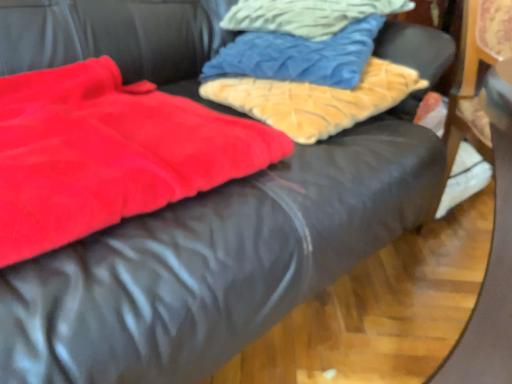
Locate an element on the screen. This screenshot has height=384, width=512. fuzzy beige pillow at upper center, the third cloth from the top is located at coordinates (316, 99).

Measure the distance between point (351, 75) and camera.

The depth of point (351, 75) is 32.87 inches.

Measure the distance between point (47, 148) and camera.

They are 22.72 inches apart.

At what (x,y) coordinates should I click in order to perform the action: click on fuzzy beige pillow at upper center, the third cloth from the top. Please return your answer as a coordinate pair (x, y). Looking at the image, I should click on (316, 99).

Is velvet blue pillow at upper center, positioned as the first cloth in top-to-bottom order, inside or outside of velvety red blanket at left?

velvet blue pillow at upper center, positioned as the first cloth in top-to-bottom order, cannot be found inside velvety red blanket at left.

Is velvet blue pillow at upper center, which is the third cloth in bottom-to-top order, in front of or behind velvety red blanket at left in the image?

Clearly, velvet blue pillow at upper center, which is the third cloth in bottom-to-top order, is behind velvety red blanket at left.

Can you confirm if velvet blue pillow at upper center, positioned as the first cloth in top-to-bottom order, is positioned to the right of velvety red blanket at left?

Yes.

Does velvet blue pillow at upper center, positioned as the first cloth in top-to-bottom order, touch velvety red blanket at left?

velvet blue pillow at upper center, positioned as the first cloth in top-to-bottom order, and velvety red blanket at left are clearly separated.

Is point (321, 41) farther from camera compared to point (318, 21)?

No.

In the image, is velvet blue pillow at upper center, the 2th cloth positioned from the bottom, positioned in front of or behind velvet blue pillow at upper center, positioned as the first cloth in top-to-bottom order?

Visually, velvet blue pillow at upper center, the 2th cloth positioned from the bottom, is located in front of velvet blue pillow at upper center, positioned as the first cloth in top-to-bottom order.

From the image's perspective, would you say velvet blue pillow at upper center, the 2th cloth positioned from the bottom, is shown under velvet blue pillow at upper center, which is the third cloth in bottom-to-top order?

Indeed, from the image's perspective, velvet blue pillow at upper center, the 2th cloth positioned from the bottom, is shown beneath velvet blue pillow at upper center, which is the third cloth in bottom-to-top order.

Can velvet blue pillow at upper center, which is the third cloth in bottom-to-top order, be found inside velvet blue pillow at upper center, the 2th cloth positioned from the bottom?

Yes.

Does velvet blue pillow at upper center, which is the third cloth in bottom-to-top order, come in front of fuzzy beige pillow at upper center, the third cloth from the top?

No, it is not.

Is velvet blue pillow at upper center, which is the third cloth in bottom-to-top order, far away from fuzzy beige pillow at upper center, the 1th cloth from the bottom?

They are positioned close to each other.

You are a GUI agent. You are given a task and a screenshot of the screen. Output one action in this format:
    pyautogui.click(x=<x>, y=<y>)
    Task: Click on the 2nd cloth behind when counting from the fuzzy beige pillow at upper center, the third cloth from the top
    
    Given the screenshot: What is the action you would take?
    pyautogui.click(x=306, y=15)

Image resolution: width=512 pixels, height=384 pixels. Find the location of `cloth that is the 1st object located behind the velvety red blanket at left`. cloth that is the 1st object located behind the velvety red blanket at left is located at coordinates point(316,99).

Considering the relative sizes of velvety red blanket at left and fuzzy beige pillow at upper center, the third cloth from the top, in the image provided, is velvety red blanket at left bigger than fuzzy beige pillow at upper center, the third cloth from the top,?

Correct, velvety red blanket at left is larger in size than fuzzy beige pillow at upper center, the third cloth from the top.

Looking at their sizes, would you say velvety red blanket at left is wider or thinner than fuzzy beige pillow at upper center, the third cloth from the top?

velvety red blanket at left is wider than fuzzy beige pillow at upper center, the third cloth from the top.

Does velvety red blanket at left have a smaller size compared to velvet blue pillow at upper center, the 2th cloth positioned from the bottom?

Correct, velvety red blanket at left occupies less space than velvet blue pillow at upper center, the 2th cloth positioned from the bottom.

Is velvety red blanket at left beside velvet blue pillow at upper center, the 2th cloth positioned from the bottom?

velvety red blanket at left and velvet blue pillow at upper center, the 2th cloth positioned from the bottom, are clearly separated.

Could you tell me if velvety red blanket at left is turned towards velvet blue pillow at upper center, the 2th cloth from the top?

No, velvety red blanket at left is not facing towards velvet blue pillow at upper center, the 2th cloth from the top.

In the image, is fuzzy beige pillow at upper center, the 1th cloth from the bottom, positioned in front of or behind velvety red blanket at left?

Clearly, fuzzy beige pillow at upper center, the 1th cloth from the bottom, is behind velvety red blanket at left.

Would you say fuzzy beige pillow at upper center, the third cloth from the top, is inside or outside velvety red blanket at left?

fuzzy beige pillow at upper center, the third cloth from the top, exists outside the volume of velvety red blanket at left.

In terms of height, does fuzzy beige pillow at upper center, the third cloth from the top, look taller or shorter compared to velvety red blanket at left?

In the image, fuzzy beige pillow at upper center, the third cloth from the top, appears to be taller than velvety red blanket at left.

Consider the image. Can you tell me how much fuzzy beige pillow at upper center, the 1th cloth from the bottom, and velvety red blanket at left differ in facing direction?

2.83 degrees.

Is fuzzy beige pillow at upper center, the third cloth from the top, wider or thinner than velvet blue pillow at upper center, the 2th cloth from the top?

fuzzy beige pillow at upper center, the third cloth from the top, is wider than velvet blue pillow at upper center, the 2th cloth from the top.

Which is less distant, [339,93] or [288,69]?

The point [339,93] is in front.

In the image, is fuzzy beige pillow at upper center, the 1th cloth from the bottom, positioned in front of or behind velvet blue pillow at upper center, the 2th cloth from the top?

Visually, fuzzy beige pillow at upper center, the 1th cloth from the bottom, is located in front of velvet blue pillow at upper center, the 2th cloth from the top.

From a real-world perspective, is fuzzy beige pillow at upper center, the 1th cloth from the bottom, on velvet blue pillow at upper center, the 2th cloth positioned from the bottom?

Actually, fuzzy beige pillow at upper center, the 1th cloth from the bottom, is physically below velvet blue pillow at upper center, the 2th cloth positioned from the bottom, in the real world.

Where is `the 3rd cloth behind the velvety red blanket at left, counting from the anchor's position`? This screenshot has width=512, height=384. the 3rd cloth behind the velvety red blanket at left, counting from the anchor's position is located at coordinates (306, 15).

Where is `cloth above the velvet blue pillow at upper center, the 2th cloth positioned from the bottom (from a real-world perspective)`? cloth above the velvet blue pillow at upper center, the 2th cloth positioned from the bottom (from a real-world perspective) is located at coordinates (306, 15).

Based on their spatial positions, is velvety red blanket at left or velvet blue pillow at upper center, the 2th cloth positioned from the bottom, closer to velvet blue pillow at upper center, positioned as the first cloth in top-to-bottom order?

Among the two, velvet blue pillow at upper center, the 2th cloth positioned from the bottom, is located nearer to velvet blue pillow at upper center, positioned as the first cloth in top-to-bottom order.

When comparing their distances from fuzzy beige pillow at upper center, the 1th cloth from the bottom, does velvety red blanket at left or velvet blue pillow at upper center, which is the third cloth in bottom-to-top order, seem closer?

velvet blue pillow at upper center, which is the third cloth in bottom-to-top order.

Looking at this image, which object lies further to the anchor point velvety red blanket at left, velvet blue pillow at upper center, which is the third cloth in bottom-to-top order, or fuzzy beige pillow at upper center, the 1th cloth from the bottom?

velvet blue pillow at upper center, which is the third cloth in bottom-to-top order, is further to velvety red blanket at left.

Looking at the image, which one is located further to velvet blue pillow at upper center, the 2th cloth positioned from the bottom, fuzzy beige pillow at upper center, the third cloth from the top, or velvet blue pillow at upper center, positioned as the first cloth in top-to-bottom order?

The object further to velvet blue pillow at upper center, the 2th cloth positioned from the bottom, is velvet blue pillow at upper center, positioned as the first cloth in top-to-bottom order.

When comparing their distances from fuzzy beige pillow at upper center, the third cloth from the top, does velvety red blanket at left or velvet blue pillow at upper center, the 2th cloth positioned from the bottom, seem further?

velvety red blanket at left is further to fuzzy beige pillow at upper center, the third cloth from the top.

Considering their positions, is velvet blue pillow at upper center, the 2th cloth positioned from the bottom, positioned closer to velvet blue pillow at upper center, which is the third cloth in bottom-to-top order, than velvety red blanket at left?

velvet blue pillow at upper center, the 2th cloth positioned from the bottom, lies closer to velvet blue pillow at upper center, which is the third cloth in bottom-to-top order, than the other object.

From the image, which object appears to be nearer to velvety red blanket at left, fuzzy beige pillow at upper center, the third cloth from the top, or velvet blue pillow at upper center, positioned as the first cloth in top-to-bottom order?

Based on the image, fuzzy beige pillow at upper center, the third cloth from the top, appears to be nearer to velvety red blanket at left.

Considering their positions, is velvet blue pillow at upper center, which is the third cloth in bottom-to-top order, positioned closer to velvet blue pillow at upper center, the 2th cloth from the top, than fuzzy beige pillow at upper center, the 1th cloth from the bottom?

The object closer to velvet blue pillow at upper center, the 2th cloth from the top, is fuzzy beige pillow at upper center, the 1th cloth from the bottom.

What are the coordinates of `cloth located between velvety red blanket at left and velvet blue pillow at upper center, the 2th cloth positioned from the bottom, in the left-right direction` in the screenshot? It's located at (316, 99).

At what (x,y) coordinates should I click in order to perform the action: click on cloth between velvet blue pillow at upper center, which is the third cloth in bottom-to-top order, and fuzzy beige pillow at upper center, the 1th cloth from the bottom, vertically. Please return your answer as a coordinate pair (x, y). Looking at the image, I should click on (298, 56).